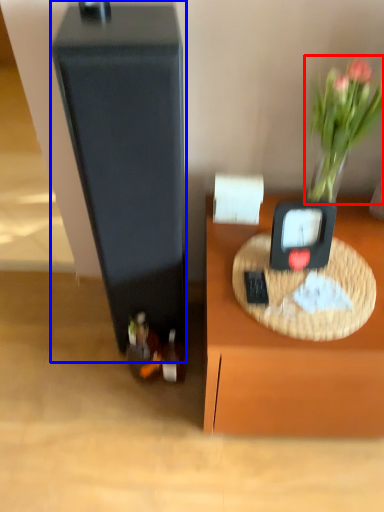
Question: Which object appears closest to the camera in this image, plant (highlighted by a red box) or wide (highlighted by a blue box)?

Choices:
 (A) plant
 (B) wide

Answer: (B)